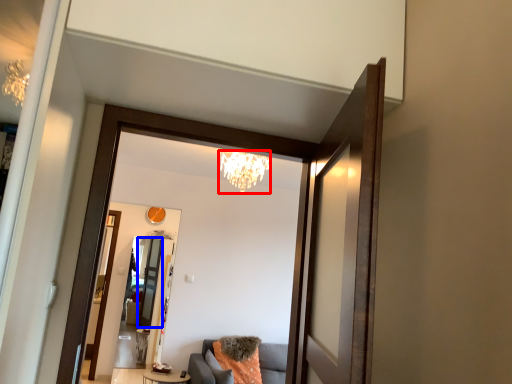
Question: Which object appears farthest to the camera in this image, light fixture (highlighted by a red box) or screen door (highlighted by a blue box)?

Choices:
 (A) light fixture
 (B) screen door

Answer: (B)